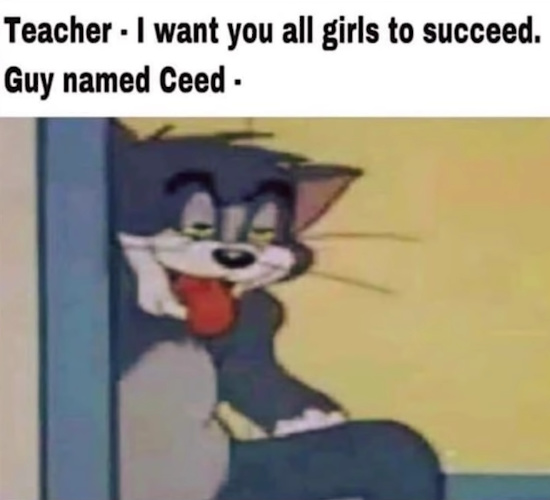
The image size is (550, 500). In order to click on yellow wall in this screenshot , I will do `click(443, 294)`.